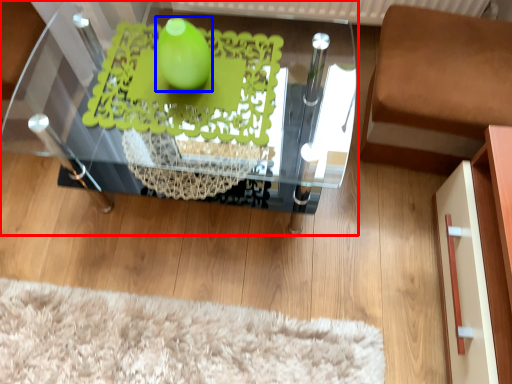
Question: Which object appears farthest to the camera in this image, table (highlighted by a red box) or lime (highlighted by a blue box)?

Choices:
 (A) table
 (B) lime

Answer: (A)